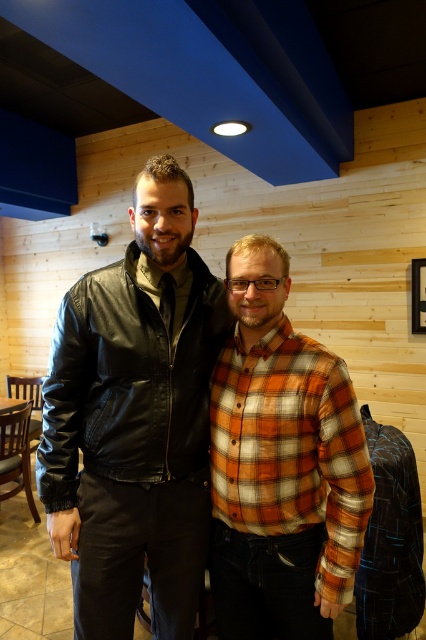
Between black leather jacket at center and orange plaid shirt at center, which one has less height?

Standing shorter between the two is orange plaid shirt at center.

Does point (71, 348) come closer to viewer compared to point (241, 576)?

Yes.

At what (x,y) coordinates should I click in order to perform the action: click on black leather jacket at center. Please return your answer as a coordinate pair (x, y). The width and height of the screenshot is (426, 640). Looking at the image, I should click on (135, 419).